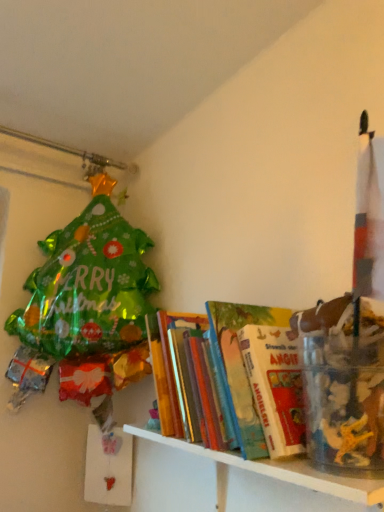
Question: Is white wooden shelf at lower right, the first shelf from the bottom, wider or thinner than hardcover books at center, the 1th shelf positioned from the top?

Choices:
 (A) wide
 (B) thin

Answer: (B)

Question: Looking at the image, does white wooden shelf at lower right, the first shelf from the bottom, seem bigger or smaller compared to hardcover books at center, the 2th shelf when ordered from bottom to top?

Choices:
 (A) big
 (B) small

Answer: (A)

Question: Is white wooden shelf at lower right, marked as the second shelf in a top-to-bottom arrangement, in front of or behind hardcover books at center, the 1th shelf positioned from the top, in the image?

Choices:
 (A) front
 (B) behind

Answer: (A)

Question: Is hardcover books at center, the 1th shelf positioned from the top, taller or shorter than white wooden shelf at lower right, the first shelf from the bottom?

Choices:
 (A) tall
 (B) short

Answer: (A)

Question: Would you say hardcover books at center, the 1th shelf positioned from the top, is inside or outside white wooden shelf at lower right, marked as the second shelf in a top-to-bottom arrangement?

Choices:
 (A) inside
 (B) outside

Answer: (B)

Question: Relative to white wooden shelf at lower right, marked as the second shelf in a top-to-bottom arrangement, is hardcover books at center, the 2th shelf when ordered from bottom to top, in front or behind?

Choices:
 (A) front
 (B) behind

Answer: (B)

Question: From a real-world perspective, is hardcover books at center, the 1th shelf positioned from the top, physically located above or below white wooden shelf at lower right, marked as the second shelf in a top-to-bottom arrangement?

Choices:
 (A) below
 (B) above

Answer: (B)